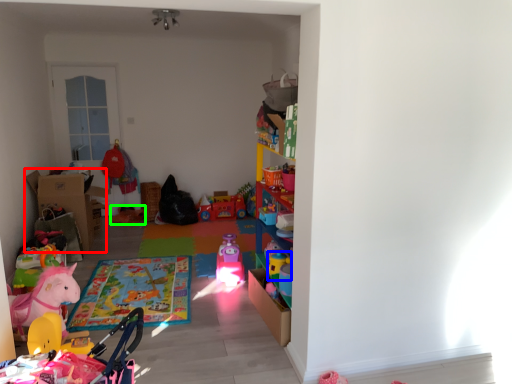
Question: Considering the real-world distances, which object is closest to cardboard box (highlighted by a red box)? toy (highlighted by a blue box) or toy (highlighted by a green box).

Choices:
 (A) toy
 (B) toy

Answer: (B)